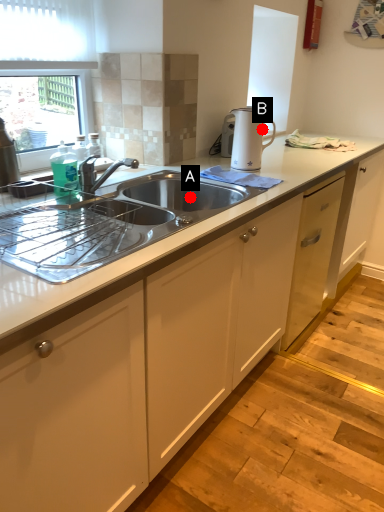
Question: Two points are circled on the image, labeled by A and B beside each circle. Which point is further to the camera?

Choices:
 (A) A is further
 (B) B is further

Answer: (B)